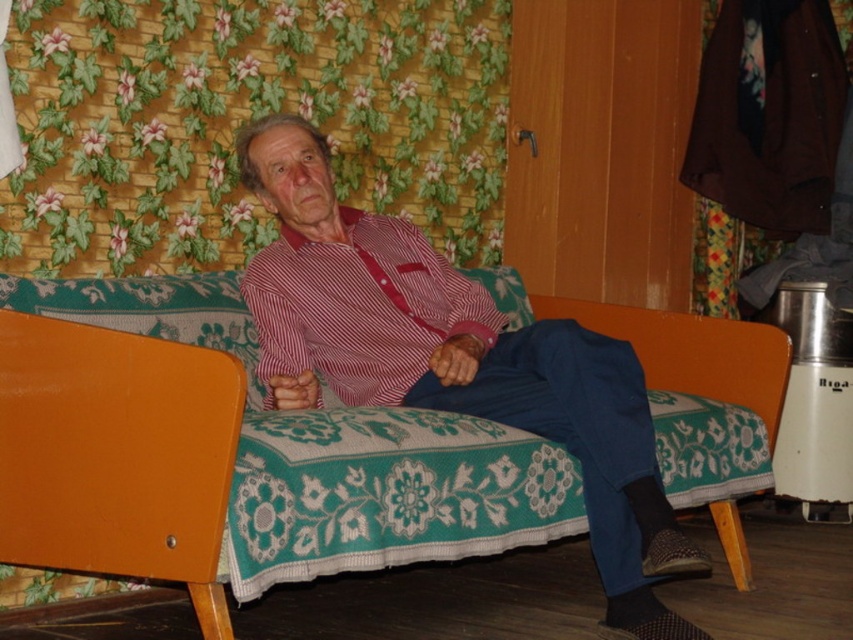
You are an assistant helping someone choose an outfit. The person has two shirts in front of them on a bench, a matte red shirt at center and a striped cotton shirt at center. Which shirt is more visible to the person sitting on the bench?

The matte red shirt at center is closer to the viewer than the striped cotton shirt at center, so the matte red shirt at center is more visible.